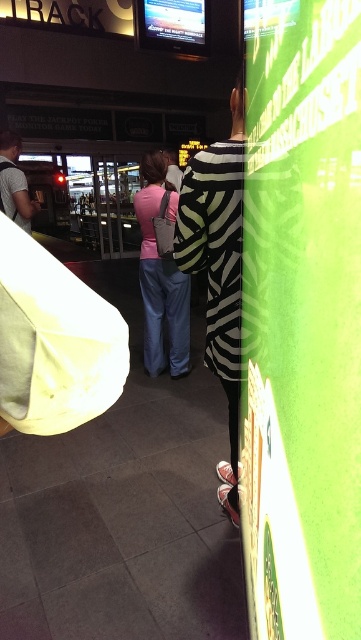
Is zebra-patterned dress at center in front of matte gray shirt at left?

Yes, it is in front of matte gray shirt at left.

Which of these two, zebra-patterned dress at center or matte gray shirt at left, stands taller?

zebra-patterned dress at center

In order to click on zebra-patterned dress at center in this screenshot , I will do `click(218, 268)`.

Identify the location of zebra-patterned dress at center. This screenshot has height=640, width=361. (218, 268).

Does pink fabric purse at center have a larger size compared to matte gray shirt at left?

Indeed, pink fabric purse at center has a larger size compared to matte gray shirt at left.

Between point (175, 211) and point (10, 198), which one is positioned in front?

Point (10, 198) is in front.

Where is `pink fabric purse at center`? This screenshot has width=361, height=640. pink fabric purse at center is located at coordinates point(162,273).

Between zebra-patterned dress at center and pink fabric purse at center, which one has more height?

zebra-patterned dress at center is taller.

Between point (214, 161) and point (150, 212), which one is positioned behind?

The point (150, 212) is behind.

Which is behind, point (232, 413) or point (172, 212)?

Positioned behind is point (172, 212).

Where is `zebra-patterned dress at center`? zebra-patterned dress at center is located at coordinates (218, 268).